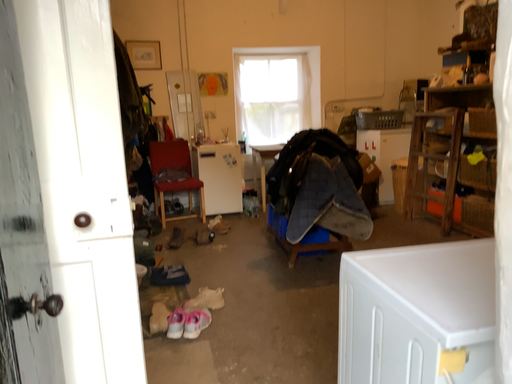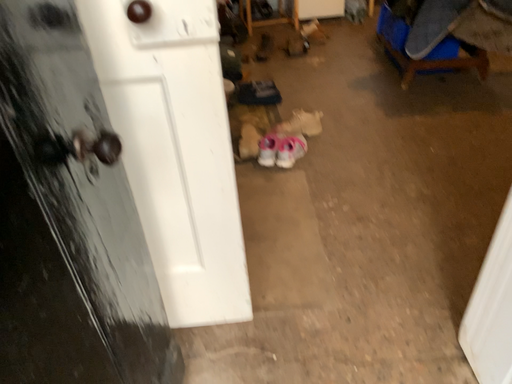
Question: How did the camera likely rotate when shooting the video?

Choices:
 (A) rotated right
 (B) rotated left

Answer: (B)